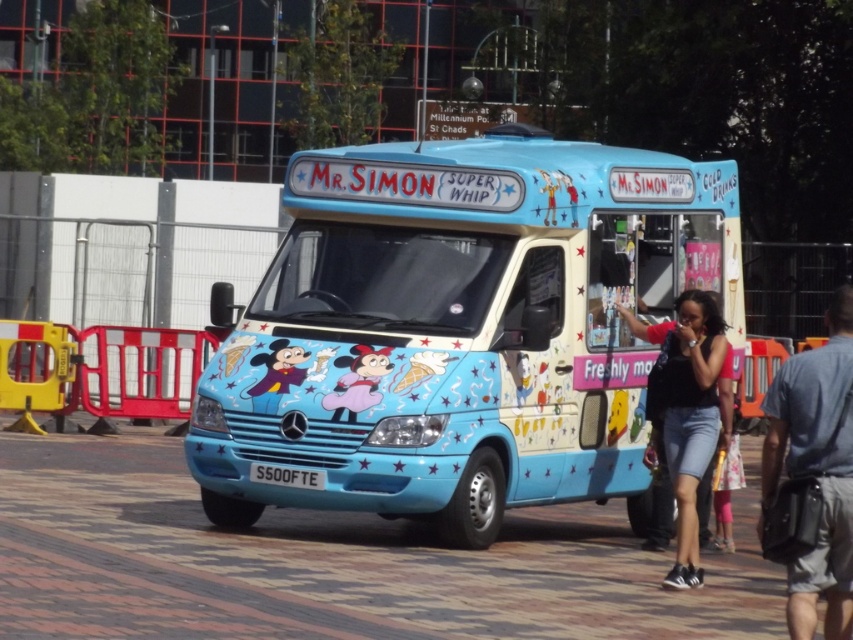
Does brick pavement at lower center have a lesser width compared to denim shorts at lower right?

In fact, brick pavement at lower center might be wider than denim shorts at lower right.

Does brick pavement at lower center have a larger size compared to denim shorts at lower right?

Yes, brick pavement at lower center is bigger than denim shorts at lower right.

Image resolution: width=853 pixels, height=640 pixels. Describe the element at coordinates (329, 563) in the screenshot. I see `brick pavement at lower center` at that location.

Identify the location of brick pavement at lower center. The width and height of the screenshot is (853, 640). (329, 563).

Does brick pavement at lower center have a lesser width compared to black denim shorts at lower right?

In fact, brick pavement at lower center might be wider than black denim shorts at lower right.

Is brick pavement at lower center wider than black denim shorts at lower right?

Yes, brick pavement at lower center is wider than black denim shorts at lower right.

Is point (398, 524) farther from viewer compared to point (711, 394)?

That is True.

You are a GUI agent. You are given a task and a screenshot of the screen. Output one action in this format:
    pyautogui.click(x=<x>, y=<y>)
    Task: Click on the brick pavement at lower center
    The image size is (853, 640).
    Given the screenshot: What is the action you would take?
    pyautogui.click(x=329, y=563)

Does light blue painted van at center have a greater width compared to black denim shorts at lower right?

Yes, light blue painted van at center is wider than black denim shorts at lower right.

Is point (302, 356) positioned after point (701, 465)?

Yes, it is behind point (701, 465).

The width and height of the screenshot is (853, 640). Find the location of `light blue painted van at center`. light blue painted van at center is located at coordinates (457, 330).